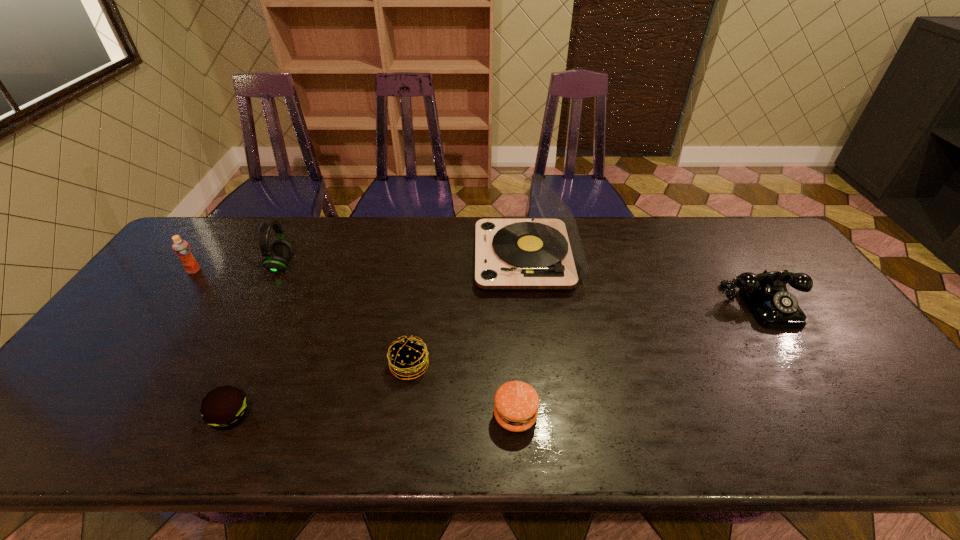
At what (x,y) coordinates should I click in order to perform the action: click on the tallest object. Please return your answer as a coordinate pair (x, y). Looking at the image, I should click on (545, 253).

The height and width of the screenshot is (540, 960). Identify the location of headset. (x=276, y=258).

At what (x,y) coordinates should I click in order to perform the action: click on orange juice. Please return your answer as a coordinate pair (x, y). The width and height of the screenshot is (960, 540). Looking at the image, I should click on (181, 248).

What are the coordinates of `the leftmost object` in the screenshot? It's located at (181, 248).

Locate an element on the screen. the rightmost object is located at coordinates (765, 294).

Image resolution: width=960 pixels, height=540 pixels. What are the coordinates of `telephone` in the screenshot? It's located at (765, 294).

Where is `the fourth object from left to right`? This screenshot has height=540, width=960. the fourth object from left to right is located at coordinates (407, 357).

At what (x,y) coordinates should I click in order to perform the action: click on the fifth farthest object. Please return your answer as a coordinate pair (x, y). Looking at the image, I should click on (407, 357).

Image resolution: width=960 pixels, height=540 pixels. Find the location of `the rightmost patty`. the rightmost patty is located at coordinates (516, 406).

At what (x,y) coordinates should I click in order to perform the action: click on the leftmost patty. Please return your answer as a coordinate pair (x, y). The width and height of the screenshot is (960, 540). Looking at the image, I should click on (224, 407).